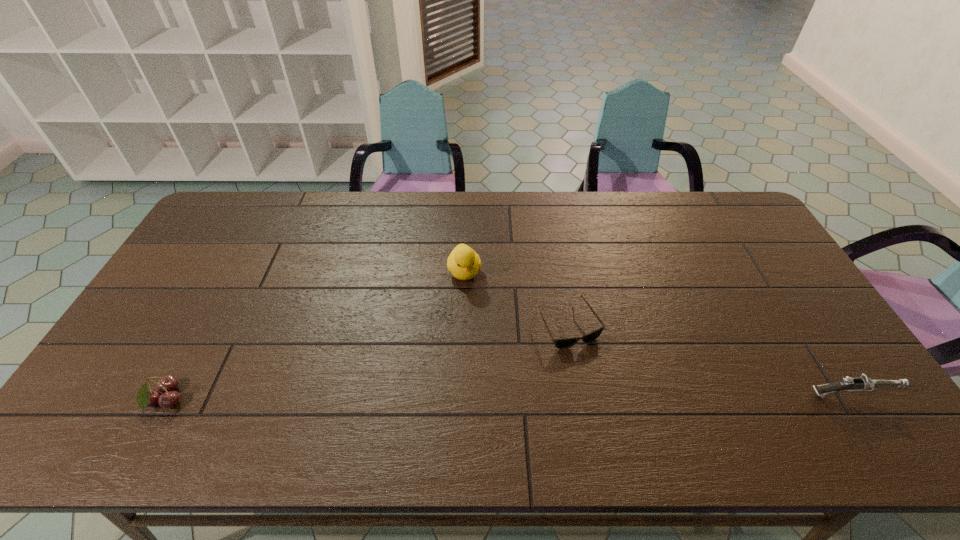
Identify the location of cherry. Image resolution: width=960 pixels, height=540 pixels. (146, 397).

Locate an element on the screen. the rightmost object is located at coordinates (862, 383).

You are a GUI agent. You are given a task and a screenshot of the screen. Output one action in this format:
    pyautogui.click(x=<x>, y=<y>)
    Task: Click on the farthest object
    This screenshot has height=540, width=960.
    Given the screenshot: What is the action you would take?
    pyautogui.click(x=464, y=263)

The width and height of the screenshot is (960, 540). What are the coordinates of `the third object from right to left` in the screenshot? It's located at (464, 263).

Where is `the shortest object`? the shortest object is located at coordinates (564, 343).

Find the location of a particular element. The height and width of the screenshot is (540, 960). the second farthest object is located at coordinates (564, 343).

The height and width of the screenshot is (540, 960). What are the coordinates of `vacant space located 0.360m on the leaves of the leftmost object` in the screenshot? It's located at (331, 401).

At what (x,y) coordinates should I click in order to perform the action: click on vacant space located on the front-facing side of the duck. Please return your answer as a coordinate pair (x, y). The image size is (960, 540). Looking at the image, I should click on (486, 361).

Locate an element on the screen. The height and width of the screenshot is (540, 960). blank space located 0.340m on the front-facing side of the duck is located at coordinates (491, 384).

Locate an element on the screen. vacant space positioned 0.360m on the front-facing side of the duck is located at coordinates (492, 391).